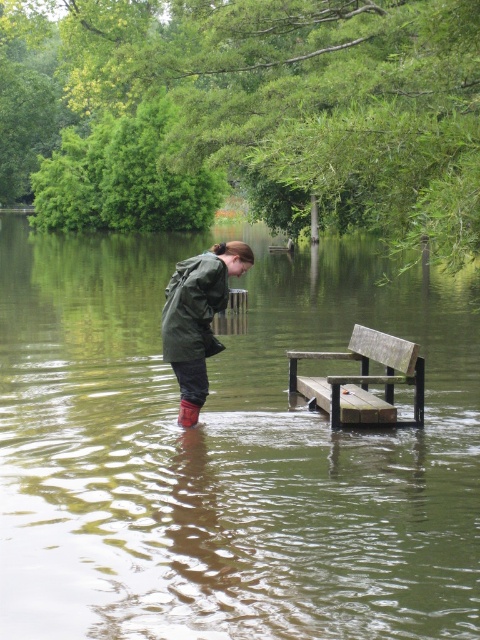
Question: In this image, where is olive-green waterproof jacket at center located relative to wooden bench at lower center?

Choices:
 (A) above
 (B) below

Answer: (A)

Question: Does olive-green waterproof jacket at center lie in front of wooden bench at lower center?

Choices:
 (A) yes
 (B) no

Answer: (A)

Question: Which point is farther to the camera?

Choices:
 (A) green matte jacket at center
 (B) green wood bench at center
 (C) wooden bench at lower center
 (D) brown rubber rain boot at lower center

Answer: (D)

Question: Is green wood bench at center above brown rubber rain boot at lower center?

Choices:
 (A) no
 (B) yes

Answer: (B)

Question: Which point is farther to the camera?

Choices:
 (A) wooden bench at lower center
 (B) green wood bench at center

Answer: (A)

Question: Which object is closer to the camera taking this photo?

Choices:
 (A) green matte jacket at center
 (B) brown rubber rain boot at lower center

Answer: (A)